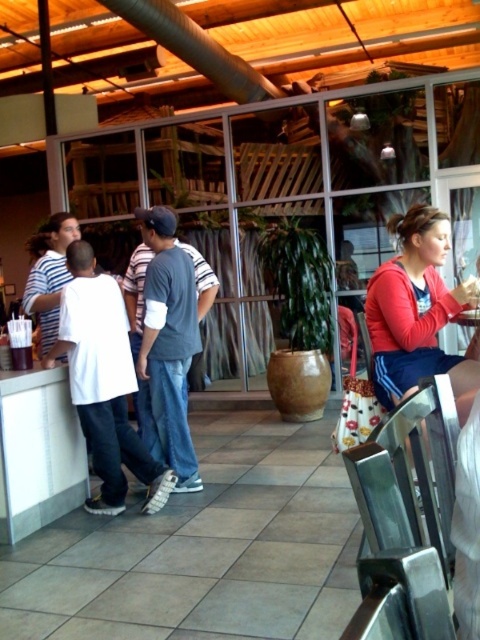
Question: Among these objects, which one is farthest from the camera?

Choices:
 (A) gray cotton shirt at center
 (B) white matte shirt at left
 (C) red fleece jacket at right

Answer: (A)

Question: Which point is farther from the camera taking this photo?

Choices:
 (A) (192, 268)
 (B) (122, 396)

Answer: (A)

Question: Where is white matte shirt at left located in relation to gray cotton shirt at center in the image?

Choices:
 (A) below
 (B) above

Answer: (A)

Question: Does white matte shirt at left have a smaller size compared to gray cotton shirt at center?

Choices:
 (A) yes
 (B) no

Answer: (A)

Question: Does white matte shirt at left have a larger size compared to gray cotton shirt at center?

Choices:
 (A) no
 (B) yes

Answer: (A)

Question: Which point is closer to the camera?

Choices:
 (A) (439, 316)
 (B) (95, 284)

Answer: (A)